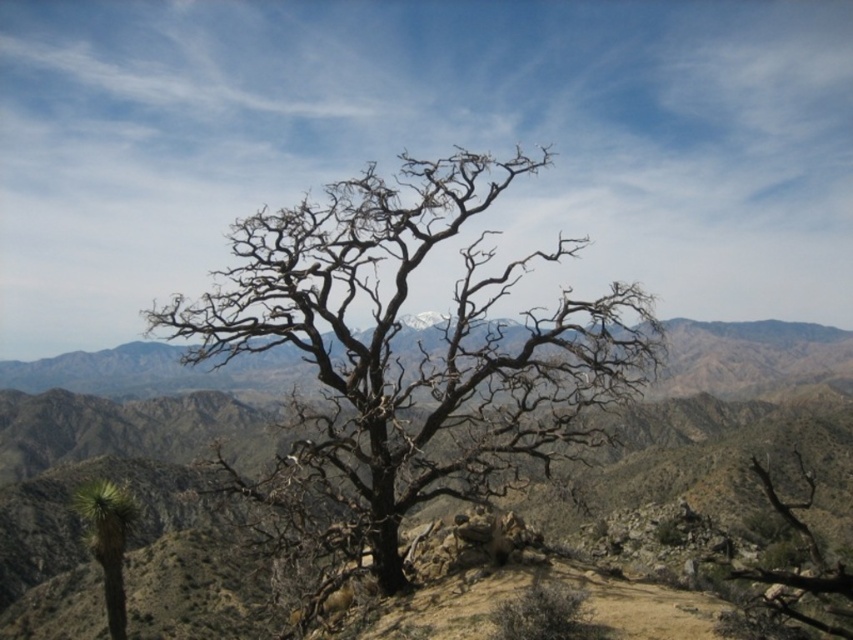
Which is more to the left, brown/dry bark tree at center or green spiky cactus at lower left?

green spiky cactus at lower left is more to the left.

Based on the photo, between brown/dry bark tree at center and green spiky cactus at lower left, which one appears on the right side from the viewer's perspective?

Positioned to the right is brown/dry bark tree at center.

Between point (490, 294) and point (103, 557), which one is positioned in front?

Positioned in front is point (490, 294).

Locate an element on the screen. This screenshot has width=853, height=640. brown/dry bark tree at center is located at coordinates (418, 349).

Between brown/dry bark tree at center and bare wood tree at center, which one is positioned lower?

Positioned lower is brown/dry bark tree at center.

Can you confirm if brown/dry bark tree at center is smaller than bare wood tree at center?

Actually, brown/dry bark tree at center might be larger than bare wood tree at center.

Measure the distance between brown/dry bark tree at center and camera.

25.47 meters

The width and height of the screenshot is (853, 640). Find the location of `brown/dry bark tree at center`. brown/dry bark tree at center is located at coordinates (418, 349).

Can you confirm if bare wood tree at center is positioned to the left of green spiky cactus at lower left?

No, bare wood tree at center is not to the left of green spiky cactus at lower left.

Is bare wood tree at center positioned in front of green spiky cactus at lower left?

Yes, bare wood tree at center is in front of green spiky cactus at lower left.

Which is in front, point (793, 576) or point (91, 524)?

Positioned in front is point (793, 576).

Locate an element on the screen. bare wood tree at center is located at coordinates (798, 568).